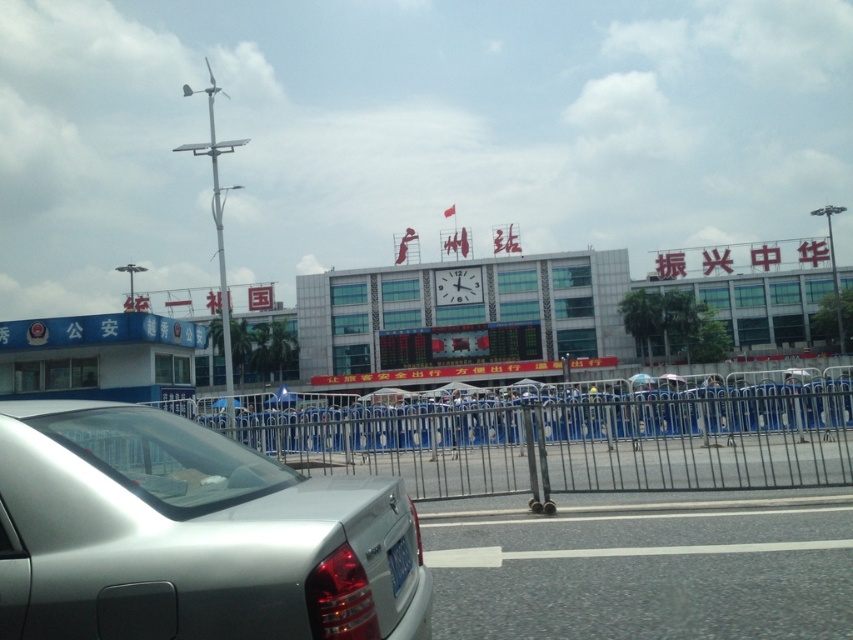
Is satin silver sedan at lower left in front of metallic blue fence at center?

Yes, it is in front of metallic blue fence at center.

Who is more distant from viewer, (171, 621) or (747, 476)?

Positioned behind is point (747, 476).

Measure the distance between satin silver sedan at lower left and camera.

satin silver sedan at lower left and camera are 2.36 meters apart from each other.

Where is `satin silver sedan at lower left`? The width and height of the screenshot is (853, 640). satin silver sedan at lower left is located at coordinates (189, 536).

Is metallic blue fence at center below blue metallic license plate at lower center?

Yes, metallic blue fence at center is below blue metallic license plate at lower center.

Which is behind, point (368, 461) or point (398, 592)?

The point (368, 461) is more distant.

This screenshot has height=640, width=853. I want to click on metallic blue fence at center, so (x=567, y=442).

Which is more to the left, satin silver sedan at lower left or blue metallic license plate at lower center?

From the viewer's perspective, satin silver sedan at lower left appears more on the left side.

Can you confirm if satin silver sedan at lower left is bigger than blue metallic license plate at lower center?

Yes, satin silver sedan at lower left is bigger than blue metallic license plate at lower center.

Is point (378, 632) positioned behind point (389, 557)?

No, (378, 632) is closer to viewer.

This screenshot has height=640, width=853. In order to click on satin silver sedan at lower left in this screenshot , I will do pos(189,536).